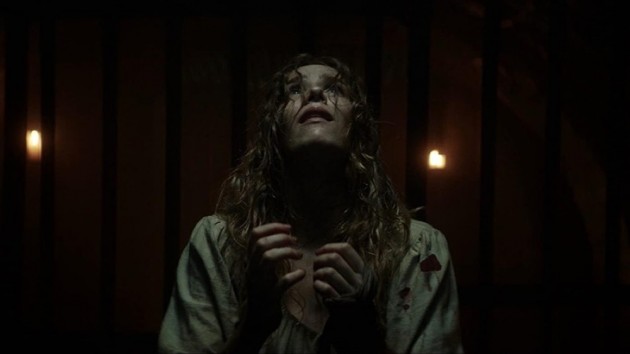
This screenshot has height=354, width=630. Find the location of `light on left side`. light on left side is located at coordinates (33, 140).